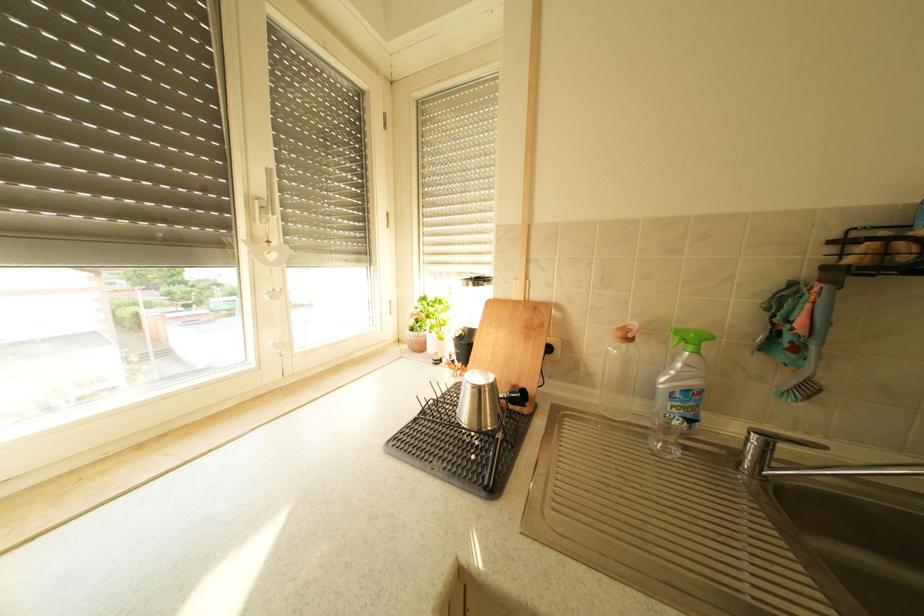
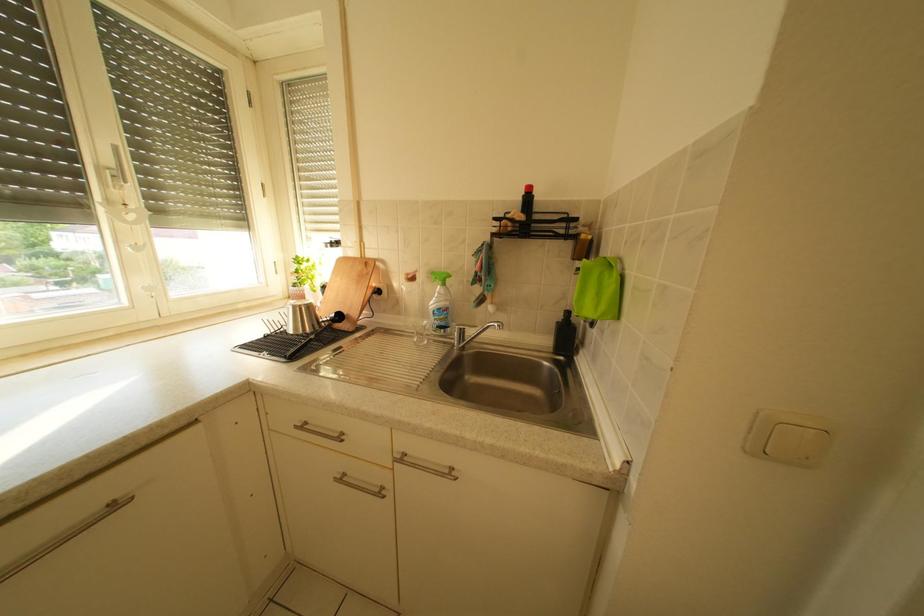
Question: Based on the continuous images, in which direction is the camera rotating? Reply with the corresponding letter.

Choices:
 (A) Left
 (B) Right
 (C) Up
 (D) Down

Answer: (B)